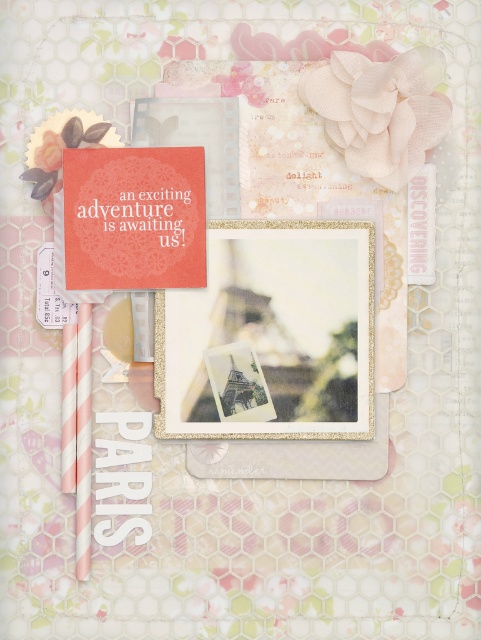
Between point (384, 156) and point (35, 168), which one is positioned in front?

Point (384, 156)

Based on the photo, measure the distance between point (330, 113) and camera.

They are 31.46 inches apart.

Who is more distant from viewer, (430, 97) or (47, 177)?

Positioned behind is point (47, 177).

Where is `peachy fabric flower at upper right`? This screenshot has width=481, height=640. peachy fabric flower at upper right is located at coordinates (379, 109).

Does point (377, 157) lie behind point (256, 104)?

No, it is not.

Can you confirm if peachy fabric flower at upper right is shorter than peachy paper flower at upper center?

In fact, peachy fabric flower at upper right may be taller than peachy paper flower at upper center.

At what (x,y) coordinates should I click in order to perform the action: click on peachy fabric flower at upper right. Please return your answer as a coordinate pair (x, y). Looking at the image, I should click on (379, 109).

Which of these two, coral paper postcard at center or peachy paper flower at upper center, stands taller?

coral paper postcard at center is taller.

Does coral paper postcard at center have a lesser width compared to peachy paper flower at upper center?

Incorrect, coral paper postcard at center's width is not less than peachy paper flower at upper center's.

Is point (66, 240) closer to camera compared to point (240, 90)?

That is True.

Where is `coral paper postcard at center`? The height and width of the screenshot is (640, 481). coral paper postcard at center is located at coordinates (134, 218).